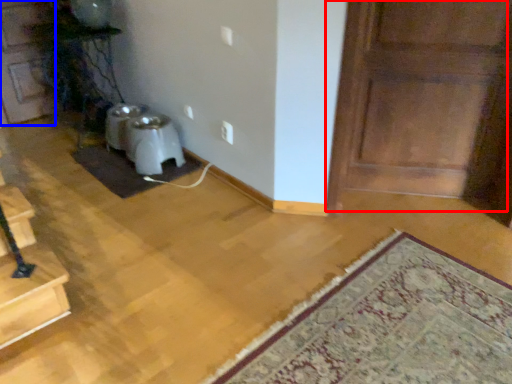
Question: Which point is further to the camera, door (highlighted by a red box) or door (highlighted by a blue box)?

Choices:
 (A) door
 (B) door

Answer: (B)